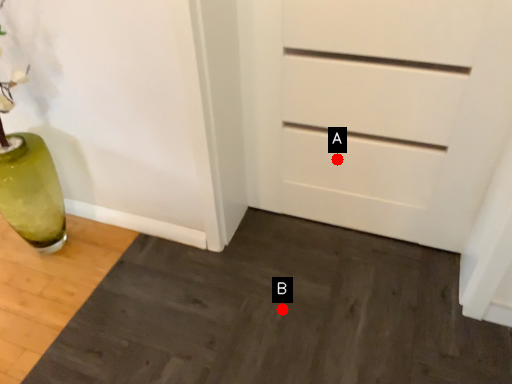
Question: Two points are circled on the image, labeled by A and B beside each circle. Which point is farther from the camera taking this photo?

Choices:
 (A) A is further
 (B) B is further

Answer: (A)